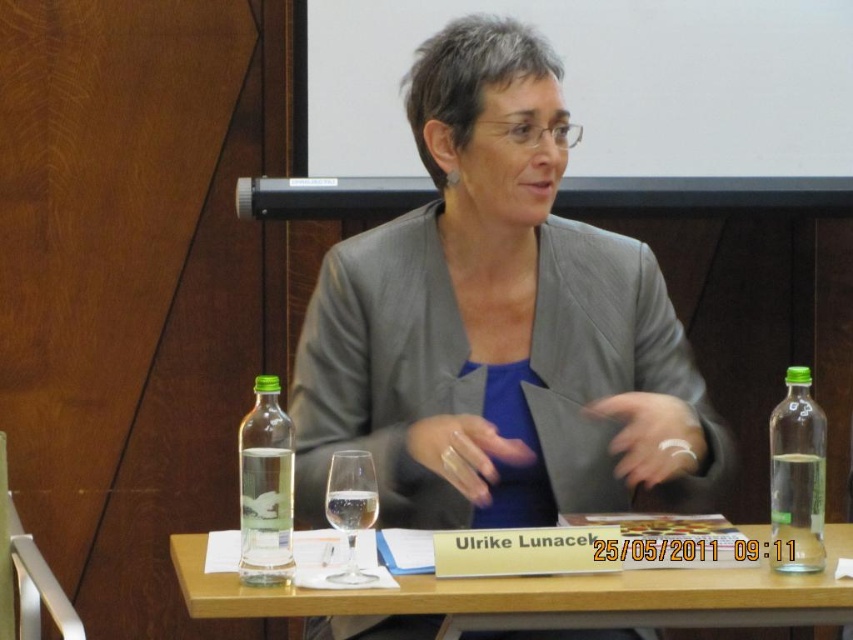
Based on the scene description, what is the 2D coordinate of the wooden table at center?

The wooden table at center is located at the 2D coordinate point of (546, 595).

You are a photographer setting up for a formal event. You need to ensure there is enough space between the gray fabric jacket at center and the wooden table at center to place a 12 inch wide decorative plate. Is there sufficient space?

The distance between the gray fabric jacket at center and the wooden table at center is 14.04 inches, which is greater than the 12 inch width of the decorative plate. Therefore, there is enough space to place the plate between them.

You are organizing a conference and need to place a new folder between the gray fabric jacket at center and the wooden table at center. Which object should the folder be closer to if it needs to be placed on the thinner side?

The gray fabric jacket at center is thinner than the wooden table at center, so the folder should be placed closer to the gray fabric jacket at center to be on the thinner side.